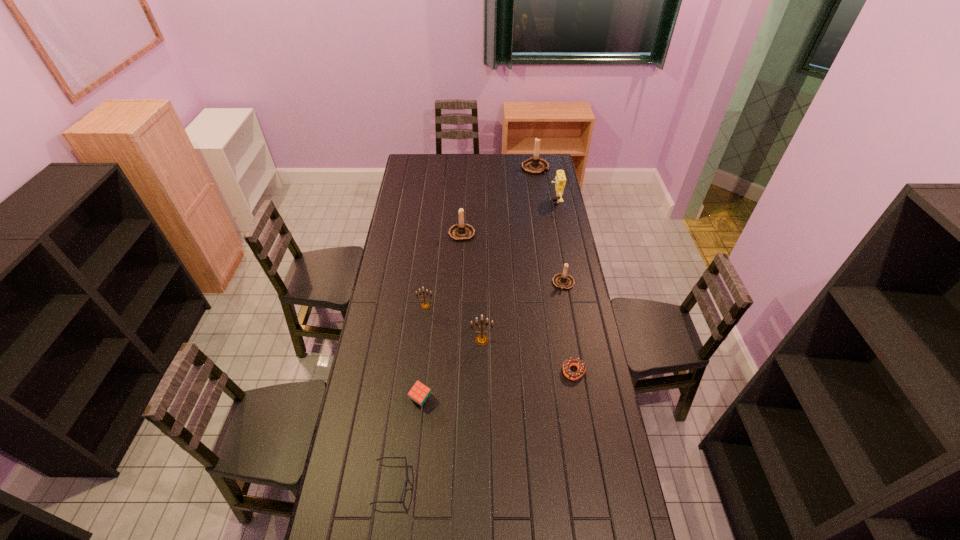
Locate an element on the screen. This screenshot has width=960, height=540. free point that satisfies the following two spatial constraints: 1. on the back side of the tallest candelabrum; 2. on the left side of the third farthest object is located at coordinates (465, 167).

Locate an element on the screen. This screenshot has width=960, height=540. vacant space that satisfies the following two spatial constraints: 1. on the front side of the third nearest object; 2. on the right side of the left gold candelabrum is located at coordinates (418, 372).